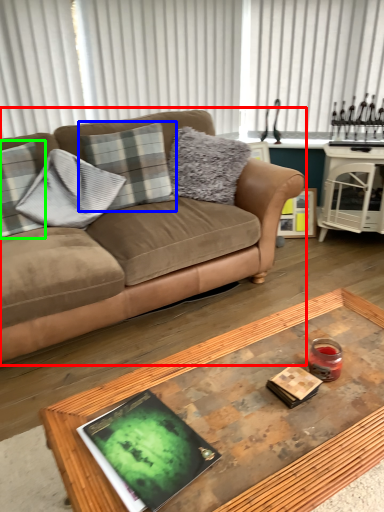
Question: Which object is positioned closest to studio couch (highlighted by a red box)? Select from pillow (highlighted by a blue box) and pillow (highlighted by a green box).

Choices:
 (A) pillow
 (B) pillow

Answer: (A)